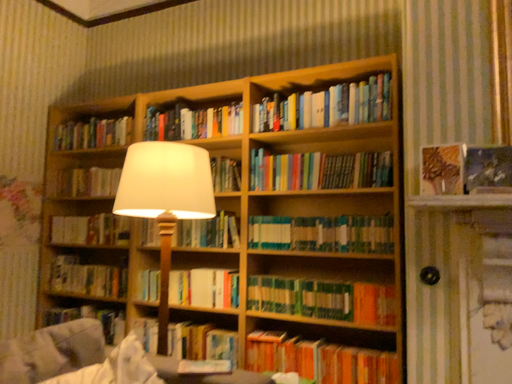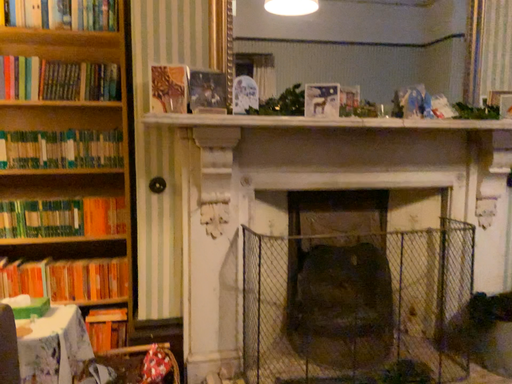
Question: How did the camera likely rotate when shooting the video?

Choices:
 (A) rotated downward
 (B) rotated upward

Answer: (A)